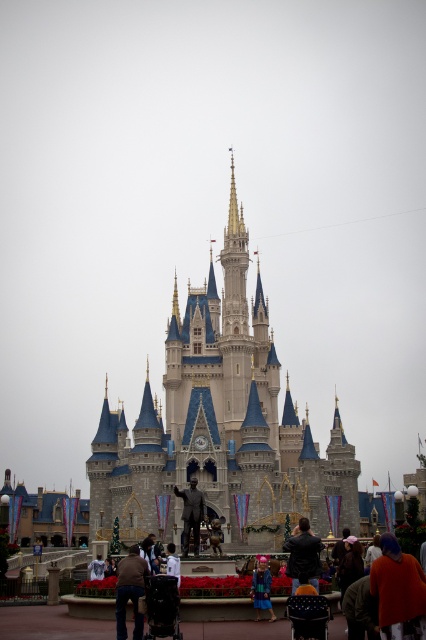
You are a tourist visiting the castle and want to take a photo with both the orange fabric jacket at lower right and the light brown leather jacket at center in the frame. Which jacket should you move closer to the camera to ensure both are visible clearly?

Since the orange fabric jacket at lower right is larger in size than the light brown leather jacket at center, you should move the smaller light brown leather jacket at center closer to the camera to ensure both jackets are visible clearly.

You are a tour guide leading a group near the castle. You notice a brown leather jacket at lower left and a blue velvet coat at lower center. Which item is nearer to your current position?

The brown leather jacket at lower left is closer to the viewer than the blue velvet coat at lower center, so the brown leather jacket at lower left is nearer to your current position.

You are a tour guide leading a group around the castle gardens. You notice two jackets left unattended near the red flowers. Which jacket is closer to the castle entrance, the orange fabric jacket at lower right or the light brown leather jacket at center?

The light brown leather jacket at center is closer to the castle entrance because the orange fabric jacket at lower right is positioned to its right side, meaning it is farther away from the entrance which is likely near the center of the castle.